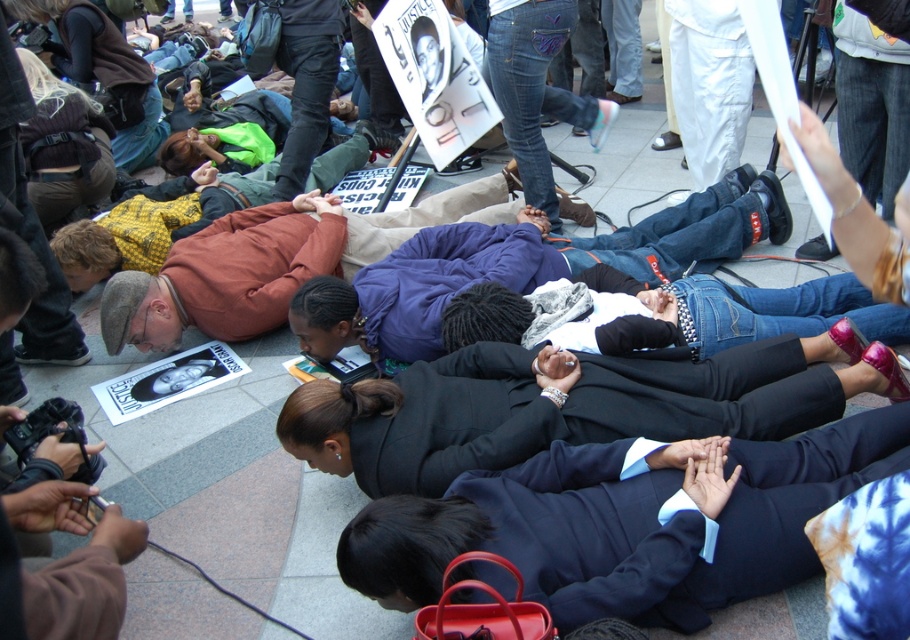
Question: Is black suit at center below denim jacket at center?

Choices:
 (A) yes
 (B) no

Answer: (A)

Question: Does black suit at center have a larger size compared to denim jacket at center?

Choices:
 (A) no
 (B) yes

Answer: (A)

Question: Is black suit at center positioned in front of denim jacket at center?

Choices:
 (A) no
 (B) yes

Answer: (B)

Question: Which point is closer to the camera taking this photo?

Choices:
 (A) (639, 433)
 (B) (318, 317)

Answer: (A)

Question: Which of the following is the closest to the observer?

Choices:
 (A) (496, 440)
 (B) (696, 198)

Answer: (A)

Question: Which object appears closest to the camera in this image?

Choices:
 (A) black suit at center
 (B) denim jacket at center

Answer: (A)